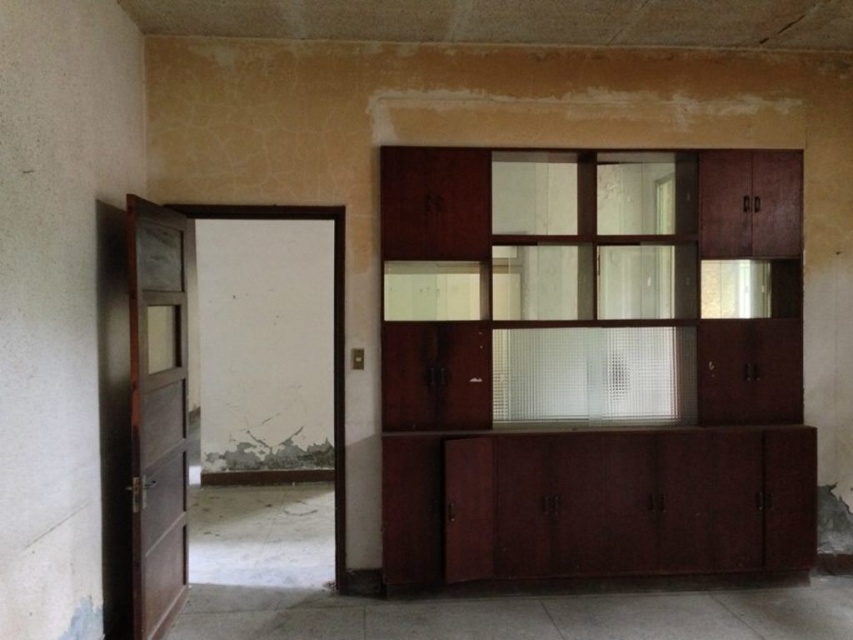
You are a contractor assessing the space for renovations. You need to determine if the mahogany wood cabinet at right can be moved through the brown wooden door at left. Based on their widths, can the cabinet fit through the door?

The mahogany wood cabinet at right might be wider than brown wooden door at left, so there is a possibility that it cannot fit through the door. Further measurements would be needed to confirm.

You are a contractor assessing the space for potential renovations. You need to determine if the mahogany wood cabinet at right can be moved through the brown wooden door at left. Based on their heights, will the cabinet fit through the door when standing upright?

The mahogany wood cabinet at right is much taller than the brown wooden door at left, so it cannot be moved through the door when standing upright.

You are standing in a room with a mahogany wood cabinet at right and a brown wooden door at left. Which object is positioned to the right side of the room?

The mahogany wood cabinet at right is positioned to the right of the brown wooden door at left, so the mahogany wood cabinet at right is on the right side of the room.